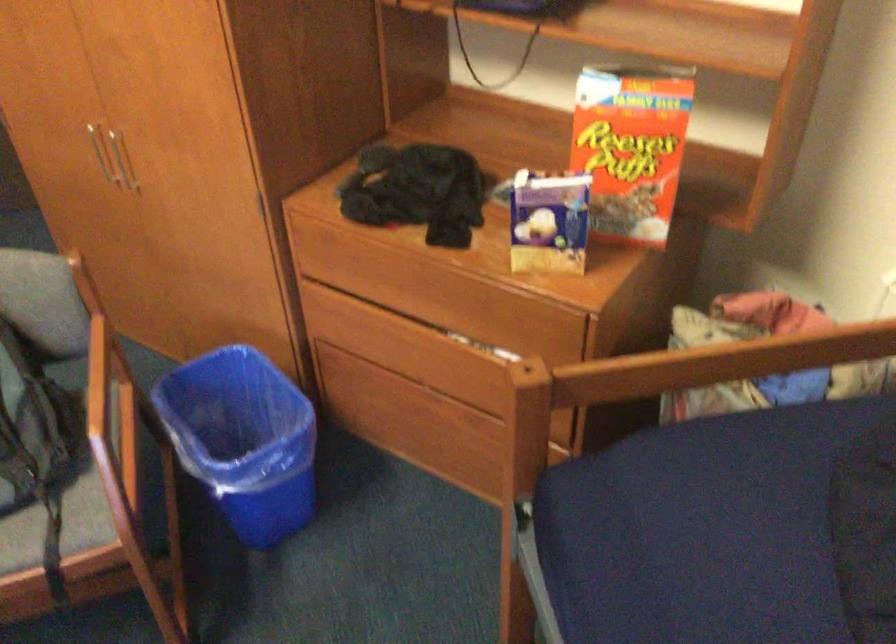
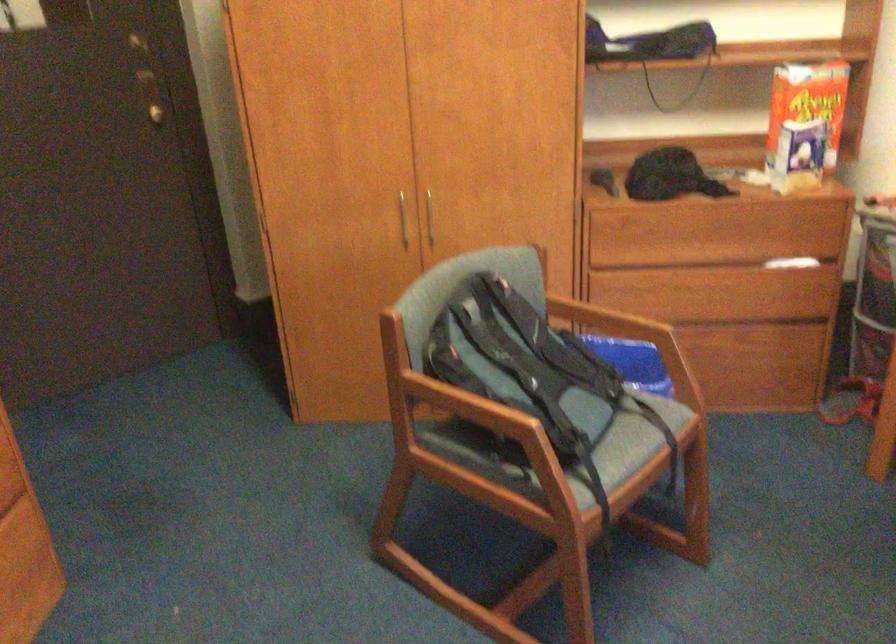
Locate, in the second image, the point that corresponds to point (418, 351) in the first image.

(700, 290)